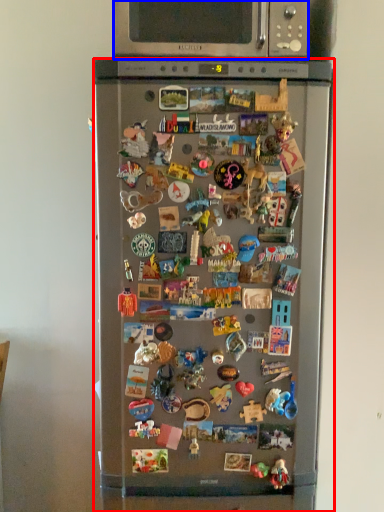
Question: Which object is further to the camera taking this photo, refrigerator (highlighted by a red box) or microwave oven (highlighted by a blue box)?

Choices:
 (A) refrigerator
 (B) microwave oven

Answer: (B)